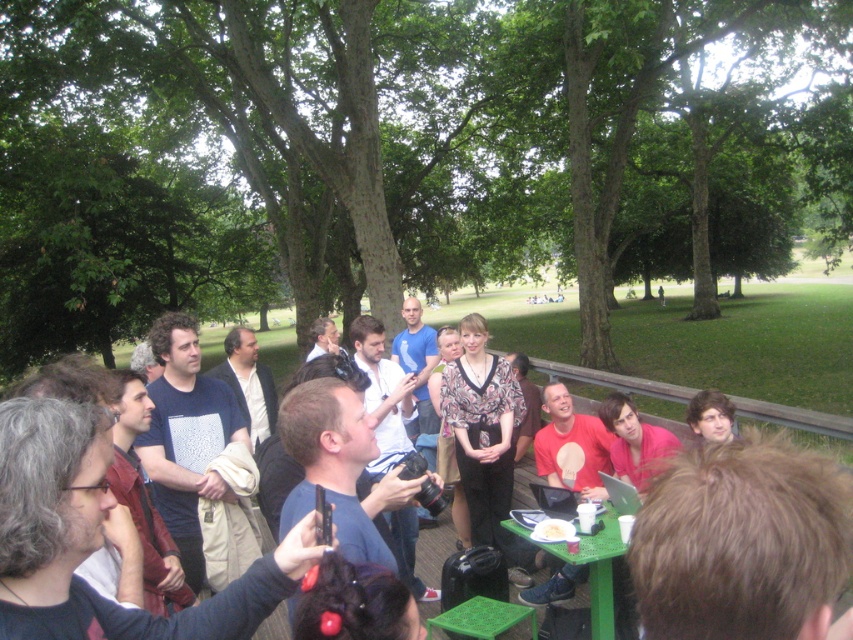
You are at a park picnic and need to place a new snack plate next to the green plastic table at center. Where should you place it relative to the white paper plate at center?

The green plastic table at center is on the right side of the white paper plate at center, so you should place the new snack plate to the left of the white paper plate at center to keep it near the table.

You are standing at the origin point of the coordinate system in the image. You want to walk directly to the green plastic table at center. What direction should you move in?

Since the green plastic table at center is located at point (590,566) in the 2D coordinate system, you should move towards the northeast direction to reach it.

From the picture: You are a photographer trying to capture a clear photo of both the green plastic table at center and the white paper plate at center. Since you want to focus on the table, where should you position the plate relative to the table?

The green plastic table at center is taller than the white paper plate at center. To focus on the table, position the plate lower or closer to the base of the table so it remains in the frame but doesn